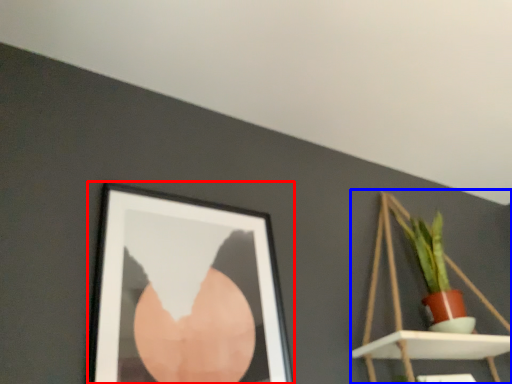
Question: Which point is closer to the camera, picture frame (highlighted by a red box) or shelf (highlighted by a blue box)?

Choices:
 (A) picture frame
 (B) shelf

Answer: (A)